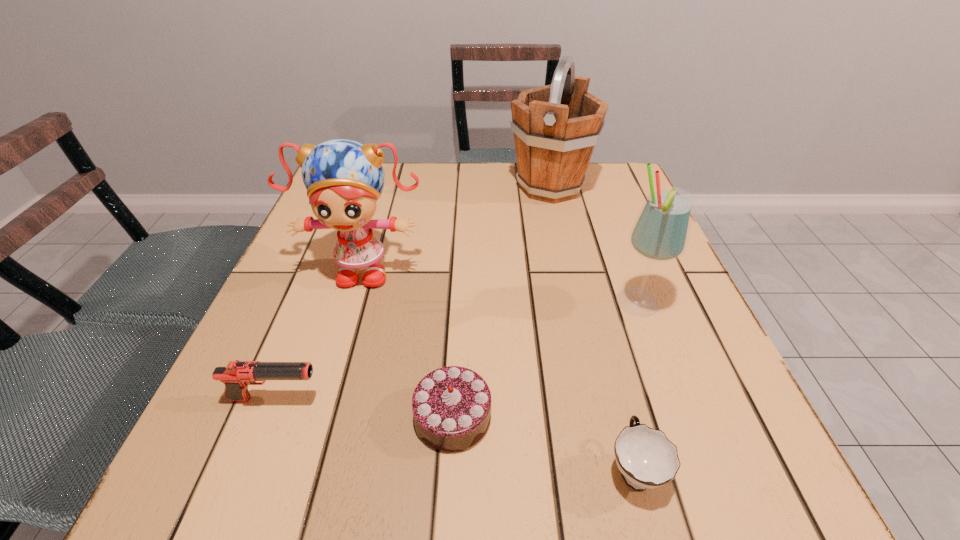
The height and width of the screenshot is (540, 960). In order to click on free space between the doll and the bucket in this screenshot , I will do `click(457, 227)`.

The width and height of the screenshot is (960, 540). What are the coordinates of `free space that is in between the alcohol and the chocolate cake` in the screenshot? It's located at (545, 360).

Locate an element on the screen. Image resolution: width=960 pixels, height=540 pixels. vacant area that lies between the cup and the bucket is located at coordinates (592, 328).

Locate an element on the screen. This screenshot has width=960, height=540. vacant area that lies between the bucket and the fourth object from right to left is located at coordinates (501, 302).

This screenshot has width=960, height=540. In order to click on vacant space that is in between the chocolate cake and the bucket in this screenshot , I will do `click(501, 302)`.

I want to click on vacant space that's between the alcohol and the cup, so click(x=636, y=386).

Image resolution: width=960 pixels, height=540 pixels. I want to click on unoccupied position between the doll and the cup, so click(498, 368).

Identify the location of free space between the doll and the bucket. This screenshot has height=540, width=960. (457, 227).

This screenshot has width=960, height=540. I want to click on vacant area that lies between the doll and the alcohol, so click(x=500, y=286).

Select which object appears as the fifth closest to the doll. Please provide its 2D coordinates. Your answer should be formatted as a tuple, i.e. [(x, y)], where the tuple contains the x and y coordinates of a point satisfying the conditions above.

[(646, 458)]